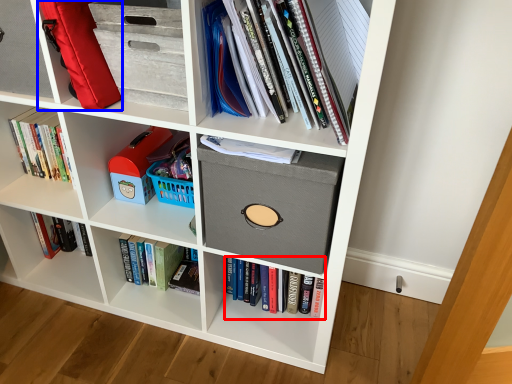
Question: Among these objects, which one is farthest to the camera, book (highlighted by a red box) or luggage (highlighted by a blue box)?

Choices:
 (A) book
 (B) luggage

Answer: (A)